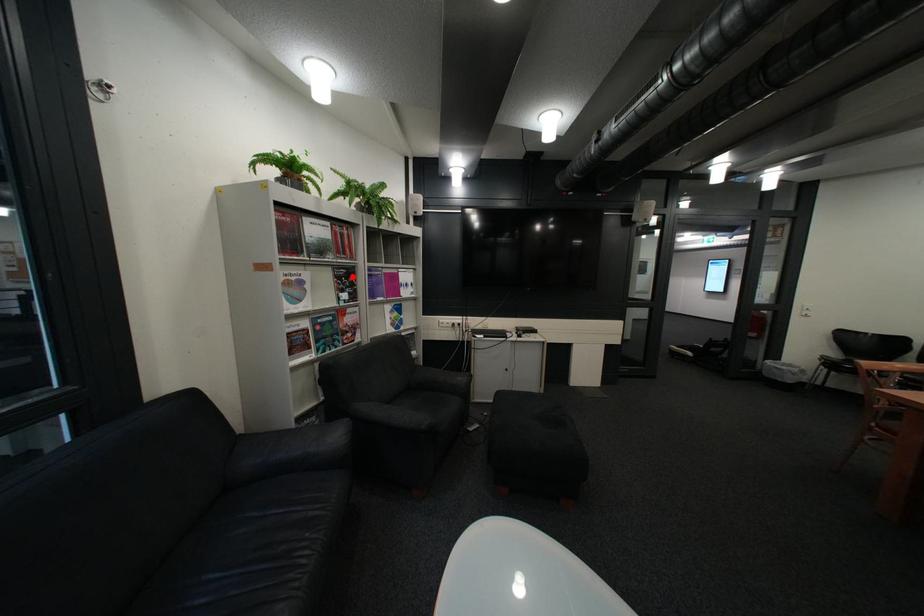
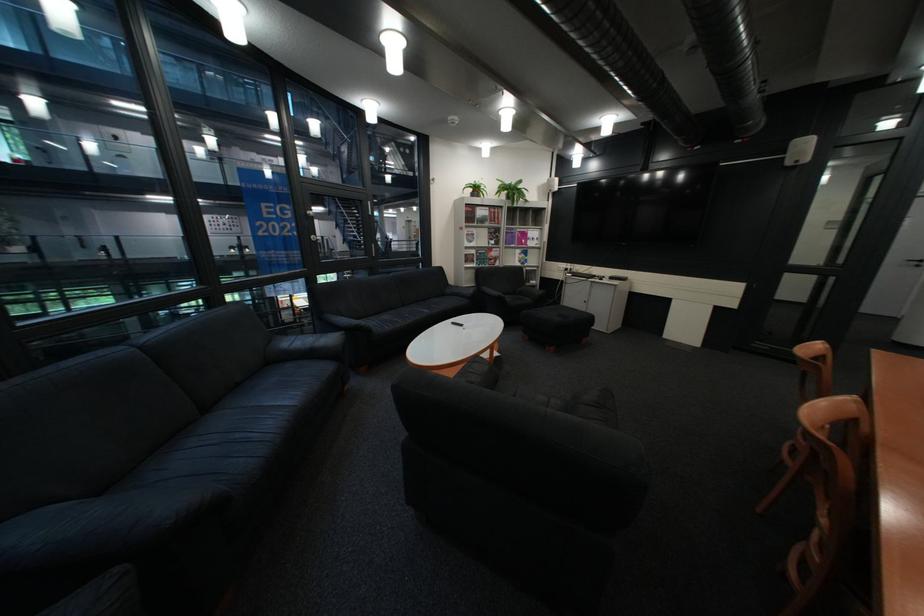
Question: I am providing you with two images of the same scene from different viewpoints. Given a red point in image1, look at the same physical point in image2. Is it:

Choices:
 (A) Closer to the viewpoint
 (B) Farther from the viewpoint

Answer: (A)